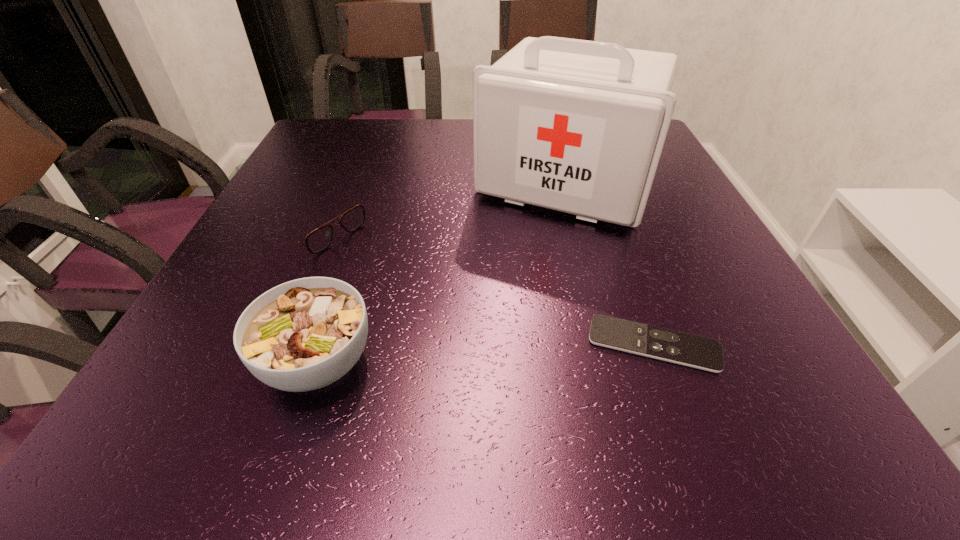
The height and width of the screenshot is (540, 960). Find the location of `free spot on the desktop that is between the soup bowl and the remote control and is positioned on the front-facing side of the sunglasses`. free spot on the desktop that is between the soup bowl and the remote control and is positioned on the front-facing side of the sunglasses is located at coordinates (536, 350).

I want to click on vacant spot on the desktop that is between the soup bowl and the shortest object and is positioned on the front-facing side of the first-aid kit, so click(472, 354).